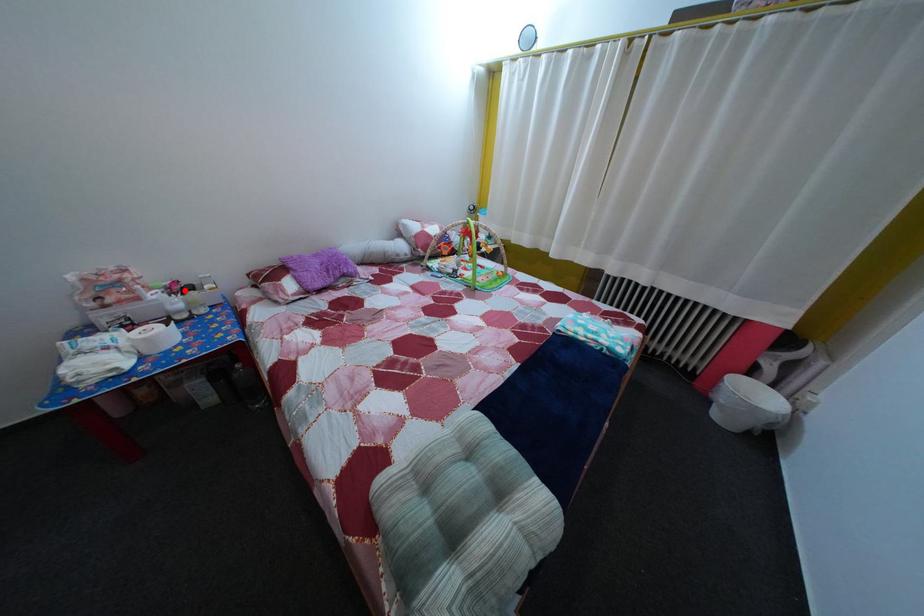
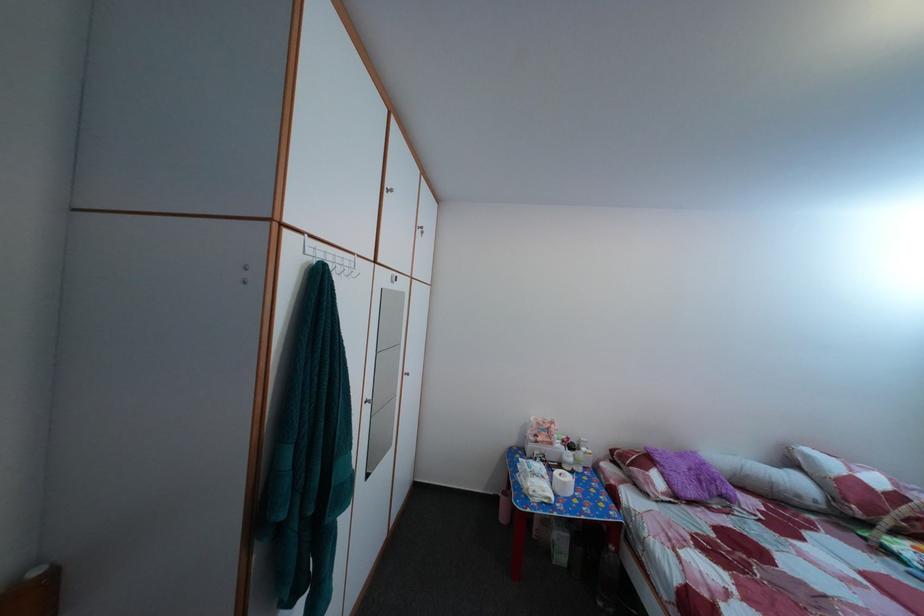
The point at the highlighted location is marked in the first image. Where is the corresponding point in the second image?

(578, 447)